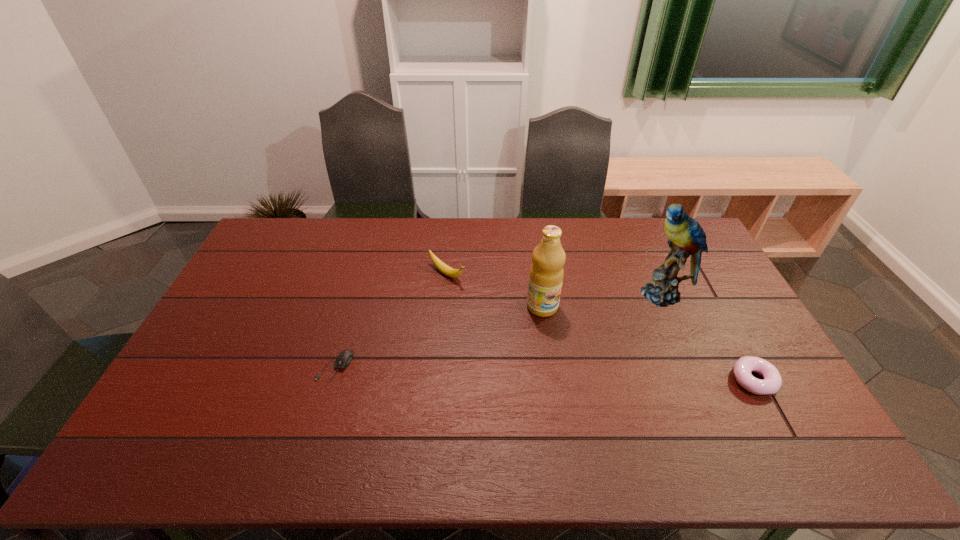
In order to click on vacant space in between the tallest object and the mouse in this screenshot , I will do `click(499, 330)`.

Identify the location of empty space that is in between the third object from left to right and the banana. (494, 291).

Find the location of a particular element. The image size is (960, 540). free space between the olive oil and the parrot is located at coordinates (603, 300).

This screenshot has width=960, height=540. Find the location of `free spot between the tallest object and the mouse`. free spot between the tallest object and the mouse is located at coordinates (499, 330).

Locate an element on the screen. The image size is (960, 540). vacant area that lies between the parrot and the second shortest object is located at coordinates (708, 336).

This screenshot has height=540, width=960. Identify the location of empty space that is in between the leftmost object and the doughnut. [544, 373].

Find the location of a particular element. Image resolution: width=960 pixels, height=540 pixels. object that stands as the second closest to the tallest object is located at coordinates pyautogui.click(x=546, y=275).

Where is `object that is the closest one to the leftmost object`? object that is the closest one to the leftmost object is located at coordinates (444, 268).

Where is `free location that satisfies the following two spatial constraints: 1. on the front side of the banana; 2. on the right side of the tallest object`? This screenshot has height=540, width=960. free location that satisfies the following two spatial constraints: 1. on the front side of the banana; 2. on the right side of the tallest object is located at coordinates (445, 293).

Find the location of a particular element. This screenshot has width=960, height=540. free space that satisfies the following two spatial constraints: 1. on the back side of the shortest object; 2. on the left side of the tallest object is located at coordinates (357, 293).